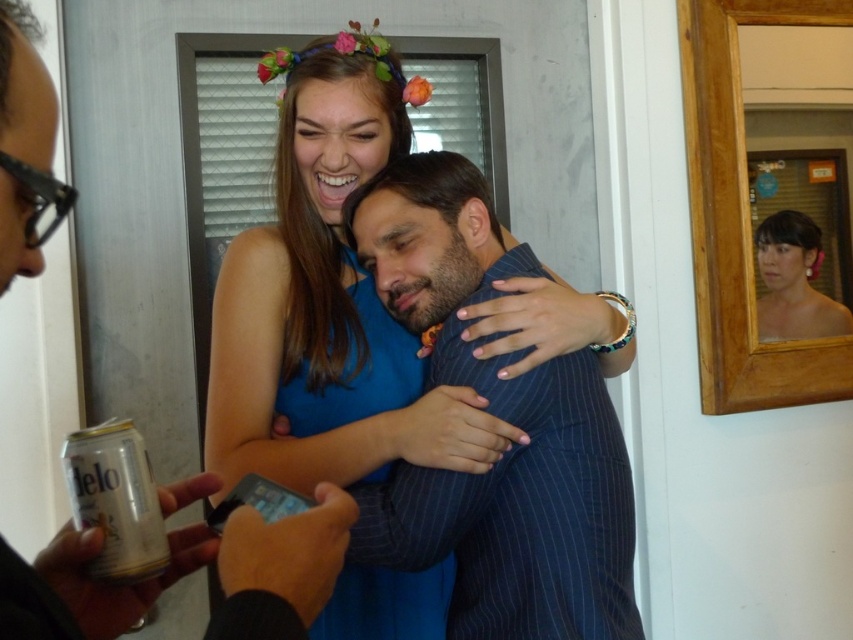
Does blue striped suit at center have a lesser width compared to smooth skin face at upper right?

No.

Who is more forward, (456, 556) or (795, 225)?

Positioned in front is point (456, 556).

Which is in front, point (524, 259) or point (833, 323)?

Point (524, 259) is more forward.

Image resolution: width=853 pixels, height=640 pixels. I want to click on blue striped suit at center, so click(502, 419).

Who is positioned more to the left, blue striped suit at center or blue pinstripe suit at center?

From the viewer's perspective, blue pinstripe suit at center appears more on the left side.

Which is in front, point (613, 579) or point (305, 579)?

Point (305, 579)

Where is `blue striped suit at center`? Image resolution: width=853 pixels, height=640 pixels. blue striped suit at center is located at coordinates (502, 419).

Can you confirm if blue pinstripe suit at center is smaller than smooth skin face at upper right?

No, blue pinstripe suit at center is not smaller than smooth skin face at upper right.

This screenshot has height=640, width=853. What do you see at coordinates (184, 573) in the screenshot?
I see `blue pinstripe suit at center` at bounding box center [184, 573].

Between point (312, 563) and point (844, 308), which one is positioned behind?

The point (844, 308) is behind.

The image size is (853, 640). In order to click on blue pinstripe suit at center in this screenshot , I will do `click(184, 573)`.